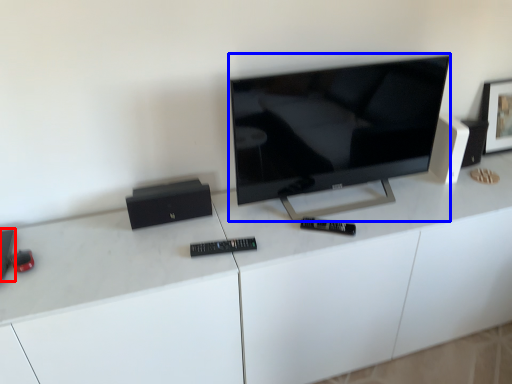
Question: Among these objects, which one is nearest to the camera, speaker (highlighted by a red box) or television (highlighted by a blue box)?

Choices:
 (A) speaker
 (B) television

Answer: (A)